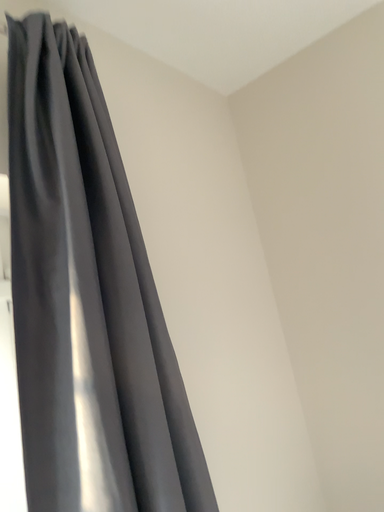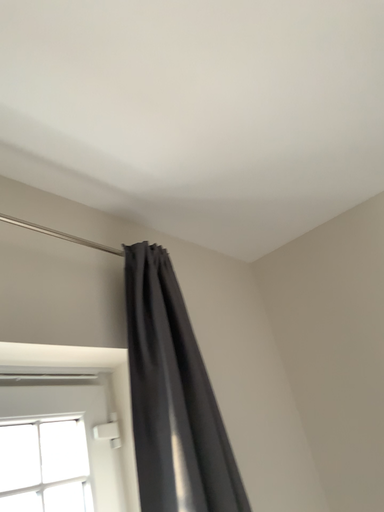
Question: Which way did the camera rotate in the video?

Choices:
 (A) rotated downward
 (B) rotated upward

Answer: (B)